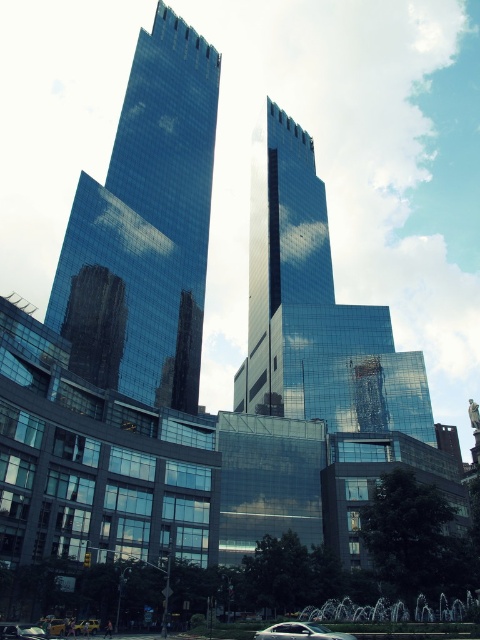
Question: Which point is farther from the camera taking this photo?

Choices:
 (A) (96, 244)
 (B) (279, 632)

Answer: (A)

Question: Among these points, which one is nearest to the camera?

Choices:
 (A) (319, 269)
 (B) (339, 632)
 (C) (88, 330)

Answer: (B)

Question: Among these points, which one is nearest to the camera?

Choices:
 (A) (193, 129)
 (B) (324, 636)
 (C) (292, 160)

Answer: (B)

Question: Is glossy glass tower at left thinner than sleek silver sedan at lower center?

Choices:
 (A) yes
 (B) no

Answer: (B)

Question: Is the position of glossy glass tower at left less distant than that of shiny glass skyscraper at center?

Choices:
 (A) no
 (B) yes

Answer: (B)

Question: Can you confirm if glossy glass tower at left is positioned to the left of shiny glass skyscraper at center?

Choices:
 (A) no
 (B) yes

Answer: (B)